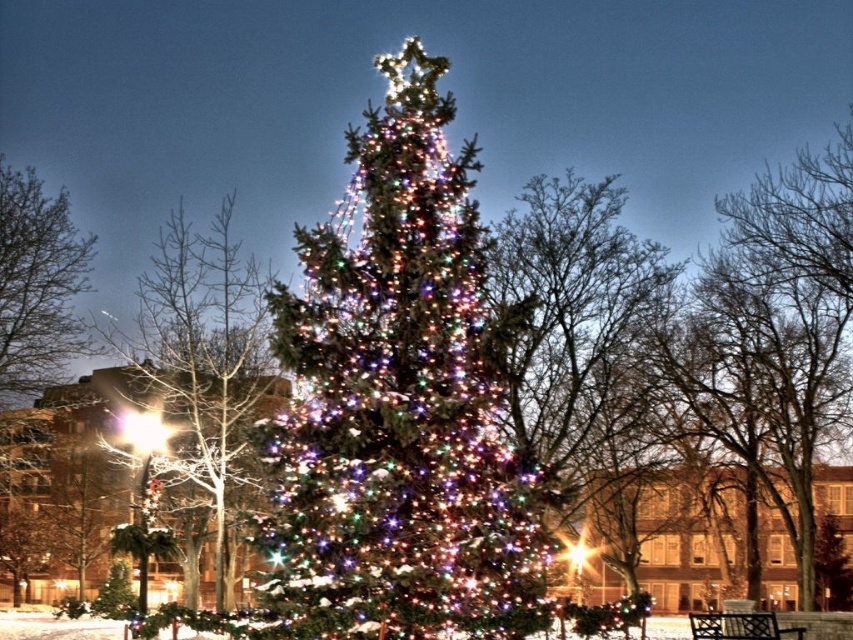
What are the coordinates of `icy white snow-covered tree at center` in the screenshot? It's located at 206,369.

Can you confirm if icy white snow-covered tree at center is positioned above green matte tree at left?

Actually, icy white snow-covered tree at center is below green matte tree at left.

Which is behind, point (219, 436) or point (55, 260)?

Positioned behind is point (55, 260).

Where is `icy white snow-covered tree at center`? This screenshot has width=853, height=640. icy white snow-covered tree at center is located at coordinates (206, 369).

How far apart are iridescent glass christmas tree at center and icy white snow-covered tree at center?

iridescent glass christmas tree at center is 7.10 meters away from icy white snow-covered tree at center.

Who is more distant from viewer, (402, 276) or (181, 412)?

The point (181, 412) is more distant.

Where is `iridescent glass christmas tree at center`? iridescent glass christmas tree at center is located at coordinates (397, 396).

Is point (264, 528) farther from camera compared to point (45, 340)?

That is False.

Between iridescent glass christmas tree at center and green matte tree at left, which one appears on the left side from the viewer's perspective?

From the viewer's perspective, green matte tree at left appears more on the left side.

Locate an element on the screen. The height and width of the screenshot is (640, 853). iridescent glass christmas tree at center is located at coordinates (397, 396).

Identify the location of iridescent glass christmas tree at center. (397, 396).